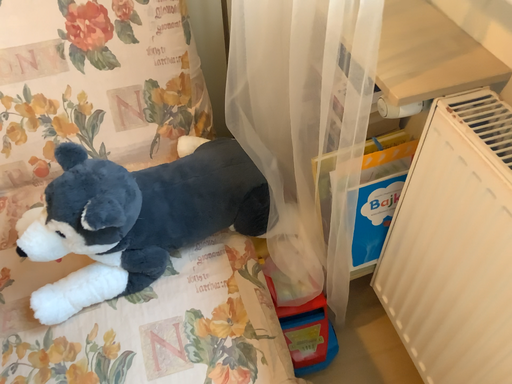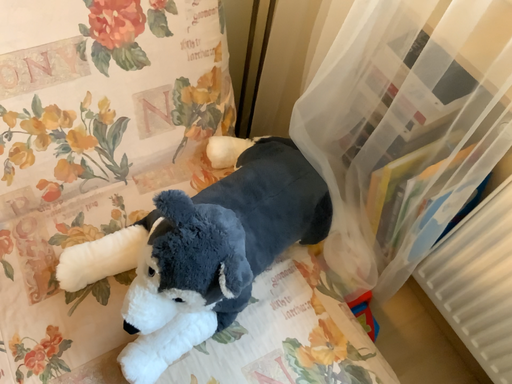
Question: How did the camera likely rotate when shooting the video?

Choices:
 (A) rotated downward
 (B) rotated upward

Answer: (A)